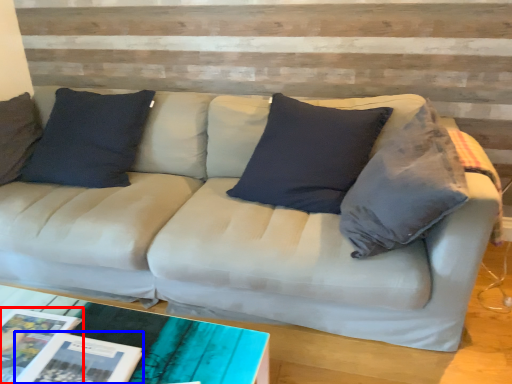
Question: Which of the following is the closest to the observer, magazine (highlighted by a red box) or magazine (highlighted by a blue box)?

Choices:
 (A) magazine
 (B) magazine

Answer: (B)